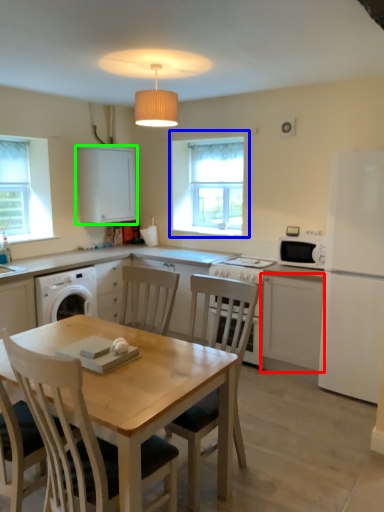
Question: Considering the real-world distances, which object is closest to cabinetry (highlighted by a red box)? window (highlighted by a blue box) or cabinetry (highlighted by a green box).

Choices:
 (A) window
 (B) cabinetry

Answer: (A)